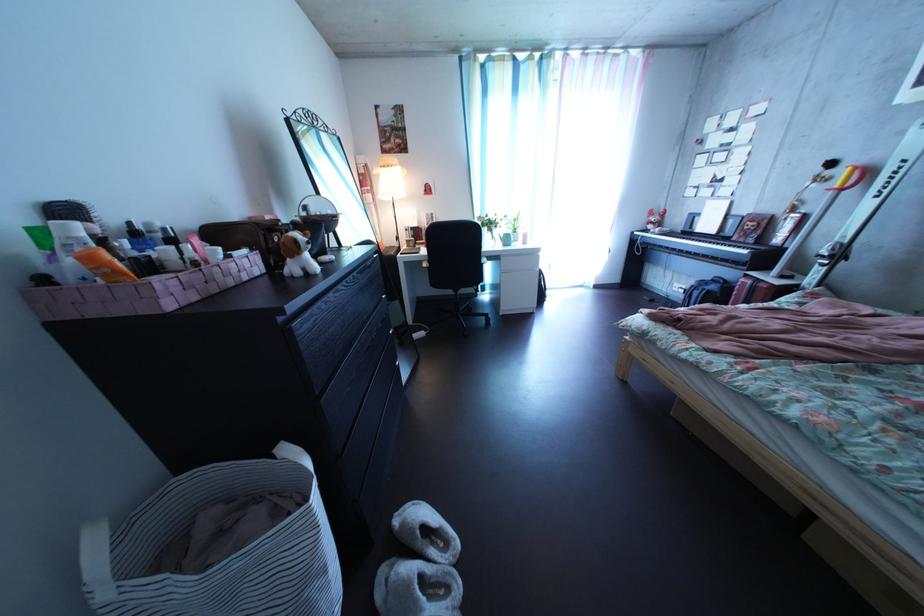
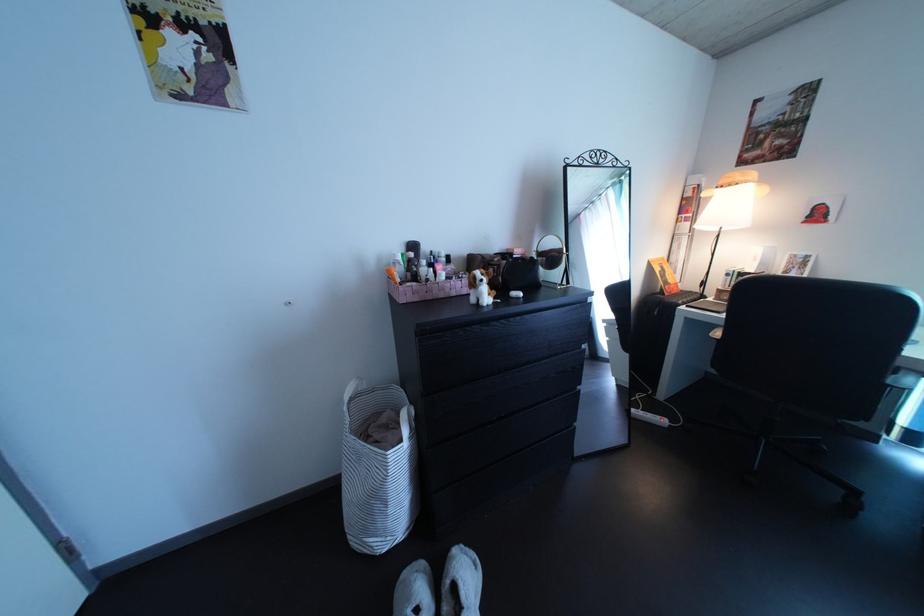
The point at (390, 180) is marked in the first image. Where is the corresponding point in the second image?

(719, 203)